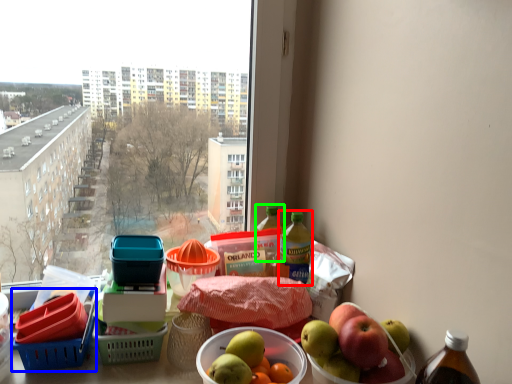
Question: Based on their relative distances, which object is farther from bottle (highlighted by a red box)? Choose from basket (highlighted by a blue box) and bottle (highlighted by a green box).

Choices:
 (A) basket
 (B) bottle

Answer: (A)